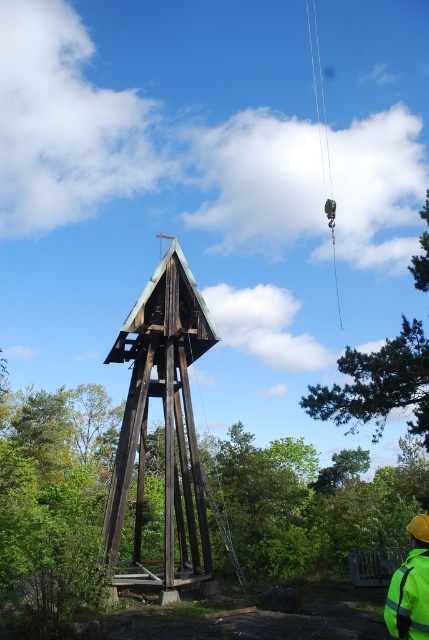
You are a construction worker on the site and need to determine which object is larger between the green leafy tree at upper right and the reflective yellow safety vest at lower right. Can you identify the larger one?

The green leafy tree at upper right is bigger than the reflective yellow safety vest at lower right, so the larger object is the green leafy tree at upper right.

You are a construction worker standing at the base of the green leafy tree at upper right and need to reach the reflective yellow safety vest at lower right. Which direction should you move to get closer to the vest?

The reflective yellow safety vest at lower right is located to the lower right of the green leafy tree at upper right. To reach it, move downward and to the right from the tree.

Based on the coordinates provided, where is the green leafy tree at upper right located in the image?

The green leafy tree at upper right is located at the coordinates point (378,385) in the image.